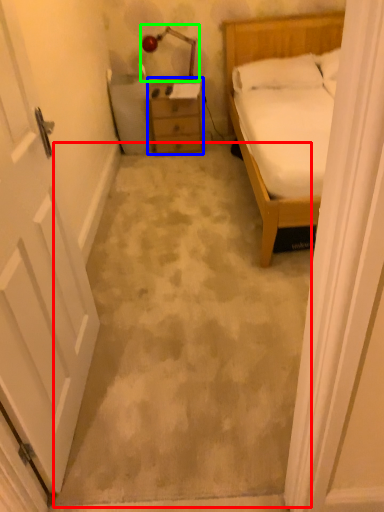
Question: Considering the real-world distances, which object is farthest from concrete (highlighted by a red box)? chest of drawers (highlighted by a blue box) or lamp (highlighted by a green box)?

Choices:
 (A) chest of drawers
 (B) lamp

Answer: (B)